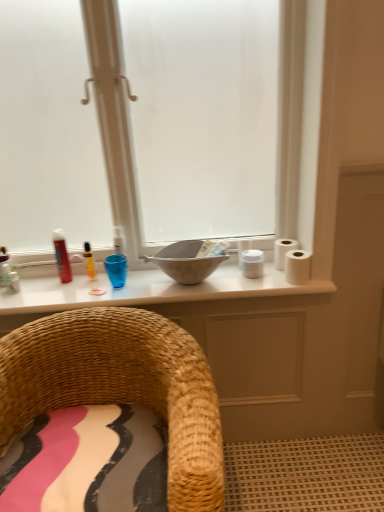
Where is `vacant region to the left of matte red can at left, acting as the 2th toiletry starting from the right`? The width and height of the screenshot is (384, 512). vacant region to the left of matte red can at left, acting as the 2th toiletry starting from the right is located at coordinates (31, 285).